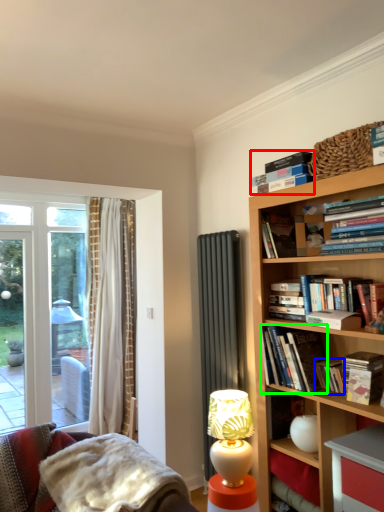
Question: Based on their relative distances, which object is nearer to book (highlighted by a red box)? Choose from paperback book (highlighted by a blue box) and book (highlighted by a green box).

Choices:
 (A) paperback book
 (B) book

Answer: (B)